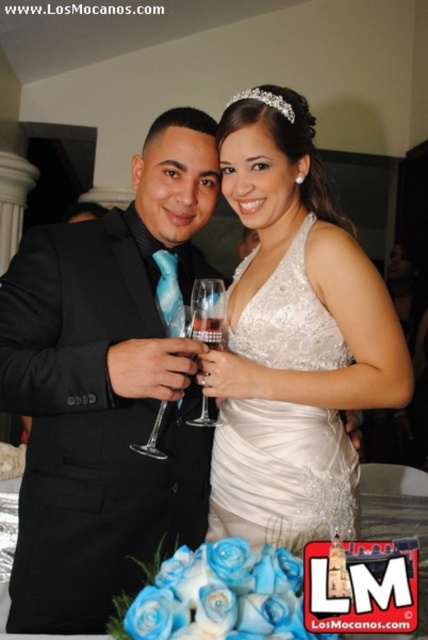
You are standing in the banquet hall and want to walk towards the two points marked in the image. Which point, point (x=68, y=621) or point (x=154, y=435), will you reach first?

You will reach point (x=68, y=621) first because it is closer to you than point (x=154, y=435).

You are a photographer at the wedding and want to capture the black satin suit at left and the clear crystal wine glass at center in a single frame. Based on their positions, which object should you focus on first to ensure both are in focus?

The black satin suit at left is above the clear crystal wine glass at center, so focusing on the black satin suit at left first would ensure both are in focus since it is closer to the camera.